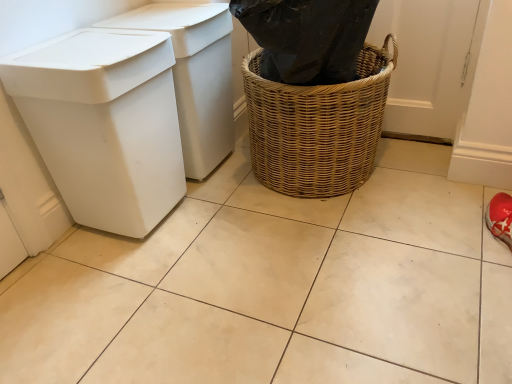
Question: Based on their positions, is white plastic bin at left, the first waste container in the back-to-front sequence, located to the left or right of woven brown basket at center?

Choices:
 (A) left
 (B) right

Answer: (A)

Question: Is white plastic bin at left, acting as the second waste container starting from the front, in front of or behind woven brown basket at center in the image?

Choices:
 (A) front
 (B) behind

Answer: (B)

Question: Based on their relative distances, which object is farther from the white plastic bin at left, the first waste container in the back-to-front sequence?

Choices:
 (A) woven brown basket at center
 (B) white plastic bin at left, which is the 2th waste container in back-to-front order

Answer: (A)

Question: Considering the real-world distances, which object is farthest from the white plastic bin at left, the first waste container in the back-to-front sequence?

Choices:
 (A) woven brown basket at center
 (B) white plastic bin at left, the 1th waste container viewed from the front

Answer: (A)